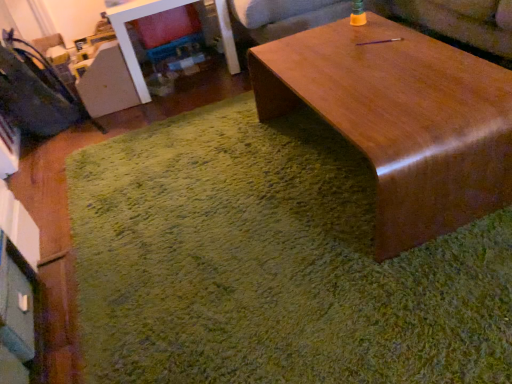
Image resolution: width=512 pixels, height=384 pixels. I want to click on vacant space to the left of glossy wood coffee table at center, so click(205, 198).